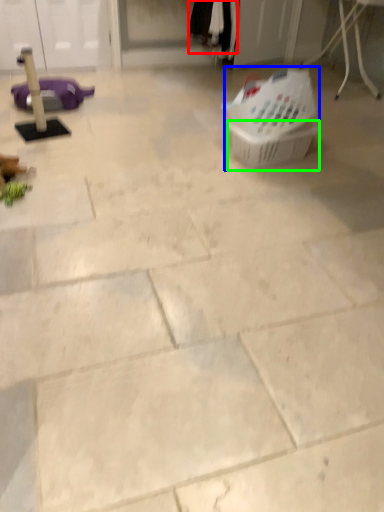
Question: Estimate the real-world distances between objects in this image. Which object is farther from clothing (highlighted by a red box), basket (highlighted by a blue box) or basket (highlighted by a green box)?

Choices:
 (A) basket
 (B) basket

Answer: (B)